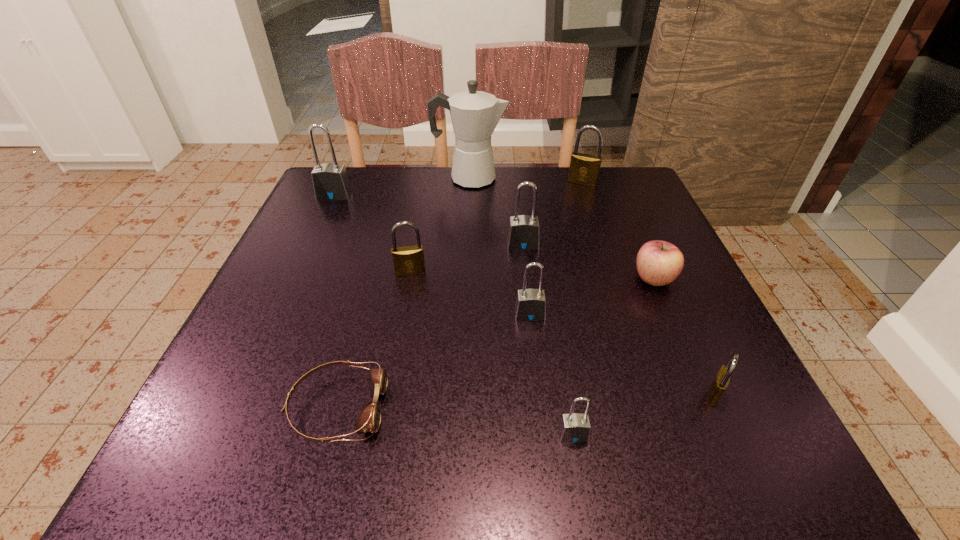
This screenshot has height=540, width=960. What are the coordinates of `free space at the far right corner of the desktop` in the screenshot? It's located at (634, 207).

Where is `free spot between the nearest gray padlock and the second farthest gray padlock`? free spot between the nearest gray padlock and the second farthest gray padlock is located at coordinates (548, 340).

Where is `free space between the goggles and the coffeepot`? free space between the goggles and the coffeepot is located at coordinates (403, 293).

Identify the location of vacant point located between the fifth nearest padlock and the rightmost padlock. 618,319.

This screenshot has height=540, width=960. In order to click on vacant space in between the smallest brass padlock and the fifth farthest padlock in this screenshot , I will do `click(622, 354)`.

What are the coordinates of `free space between the third farthest gray padlock and the smallest gray padlock` in the screenshot? It's located at (551, 375).

The width and height of the screenshot is (960, 540). I want to click on free space between the apple and the second padlock from left to right, so click(532, 276).

Where is `free space between the goggles and the smallest brass padlock`? free space between the goggles and the smallest brass padlock is located at coordinates (526, 401).

This screenshot has height=540, width=960. Find the location of `vacant area between the leftmost brass padlock and the third nearest gray padlock`. vacant area between the leftmost brass padlock and the third nearest gray padlock is located at coordinates (467, 258).

Find the location of `vacant area between the second biggest brass padlock and the third nearest padlock`. vacant area between the second biggest brass padlock and the third nearest padlock is located at coordinates (470, 293).